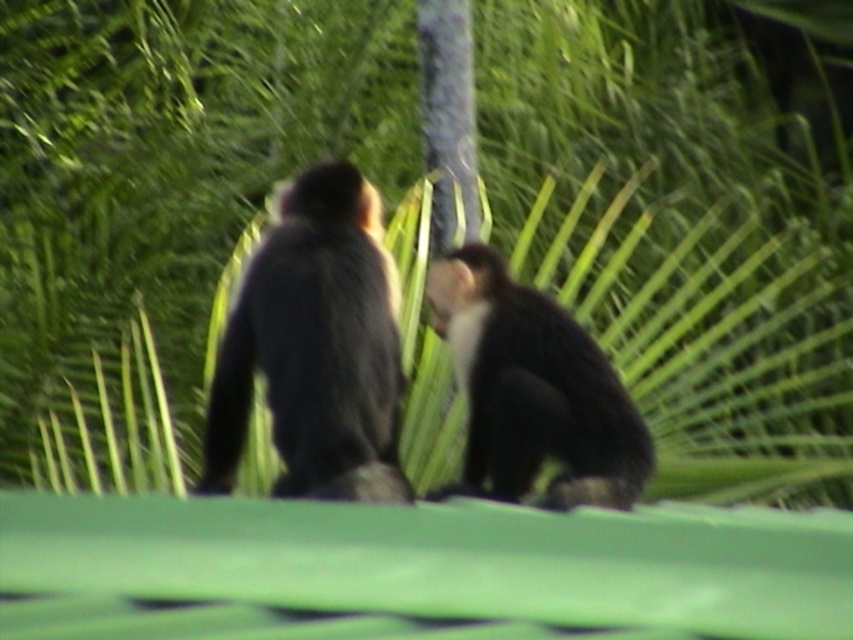
Is dark fur monkey at center further to the viewer compared to black furry monkey at center?

That is False.

Is dark fur monkey at center smaller than black furry monkey at center?

No.

Find the location of a particular element. dark fur monkey at center is located at coordinates (315, 348).

Who is positioned more to the left, black furry monkey at center or black fur tail at left?

black fur tail at left

Does black furry monkey at center have a larger size compared to black fur tail at left?

Yes.

Is point (643, 432) closer to camera compared to point (244, 342)?

No, (643, 432) is further to viewer.

At what (x,y) coordinates should I click in order to perform the action: click on black furry monkey at center. Please return your answer as a coordinate pair (x, y). The height and width of the screenshot is (640, 853). Looking at the image, I should click on (532, 390).

Is dark fur monkey at center smaller than black fur tail at left?

No, dark fur monkey at center is not smaller than black fur tail at left.

Is dark fur monkey at center thinner than black fur tail at left?

No, dark fur monkey at center is not thinner than black fur tail at left.

Is point (288, 424) farther from viewer compared to point (227, 406)?

No, it is in front of (227, 406).

At what (x,y) coordinates should I click in order to perform the action: click on dark fur monkey at center. Please return your answer as a coordinate pair (x, y). This screenshot has height=640, width=853. Looking at the image, I should click on (315, 348).